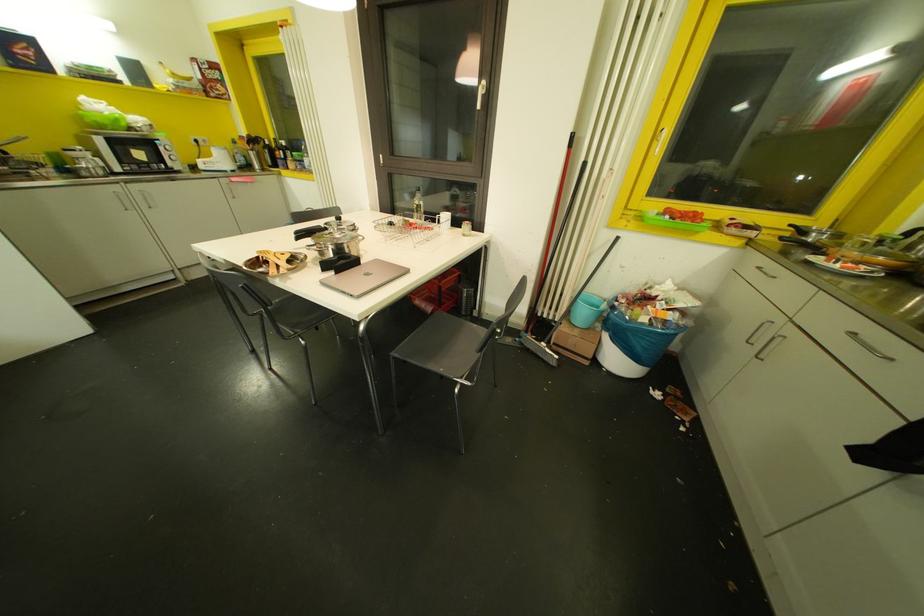
Image resolution: width=924 pixels, height=616 pixels. I want to click on silver laptop, so click(x=363, y=277).